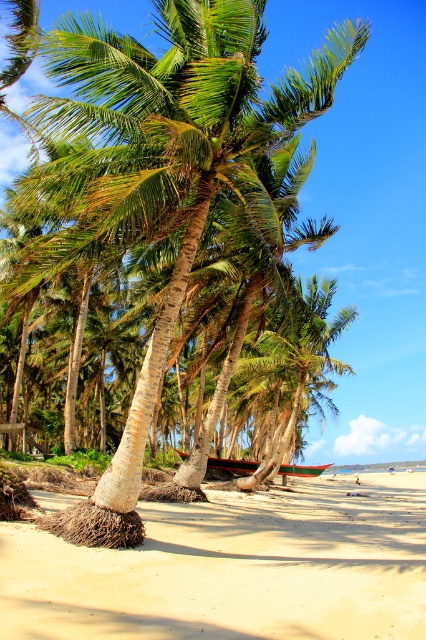
From the picture: Does sandy beach at lower center have a lesser width compared to green textured palm tree at center?

No, sandy beach at lower center is not thinner than green textured palm tree at center.

Is sandy beach at lower center above green textured palm tree at center?

No.

Between point (417, 541) and point (187, 17), which one is positioned in front?

Point (187, 17)

Where is `sandy beach at lower center`? The image size is (426, 640). sandy beach at lower center is located at coordinates (233, 568).

Does sandy beach at lower center appear under wooden canoe at center?

Actually, sandy beach at lower center is above wooden canoe at center.

Who is more distant from viewer, (298, 536) or (229, 464)?

The point (229, 464) is more distant.

Does point (31, 630) come behind point (299, 468)?

No.

This screenshot has height=640, width=426. In order to click on sandy beach at lower center in this screenshot , I will do `click(233, 568)`.

Can you confirm if green textured palm tree at center is thinner than wooden canoe at center?

Correct, green textured palm tree at center's width is less than wooden canoe at center's.

Find the location of `green textured palm tree at center`. green textured palm tree at center is located at coordinates (170, 168).

Describe the element at coordinates (170, 168) in the screenshot. The image size is (426, 640). I see `green textured palm tree at center` at that location.

At what (x,y) coordinates should I click in order to perform the action: click on green textured palm tree at center. Please return your answer as a coordinate pair (x, y). The image size is (426, 640). Looking at the image, I should click on (170, 168).